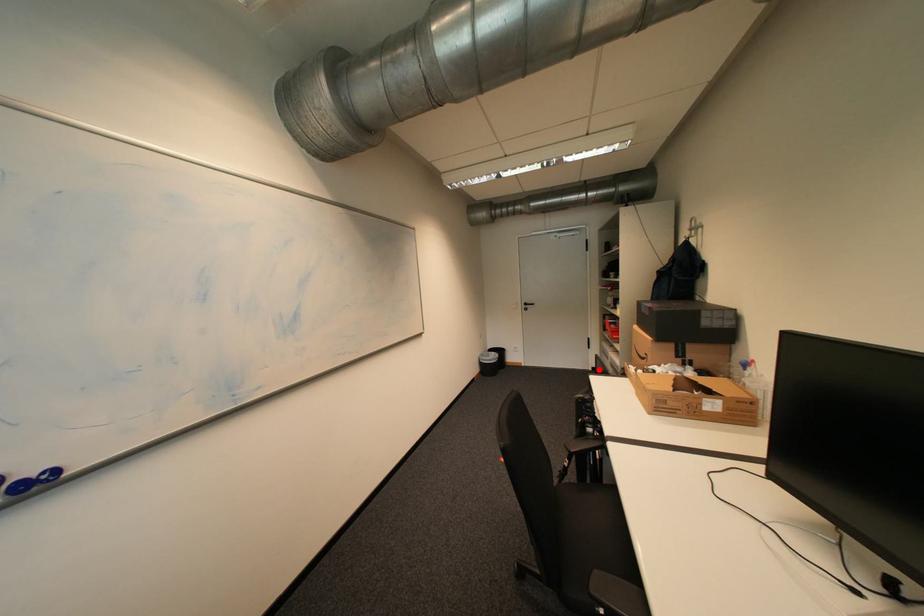
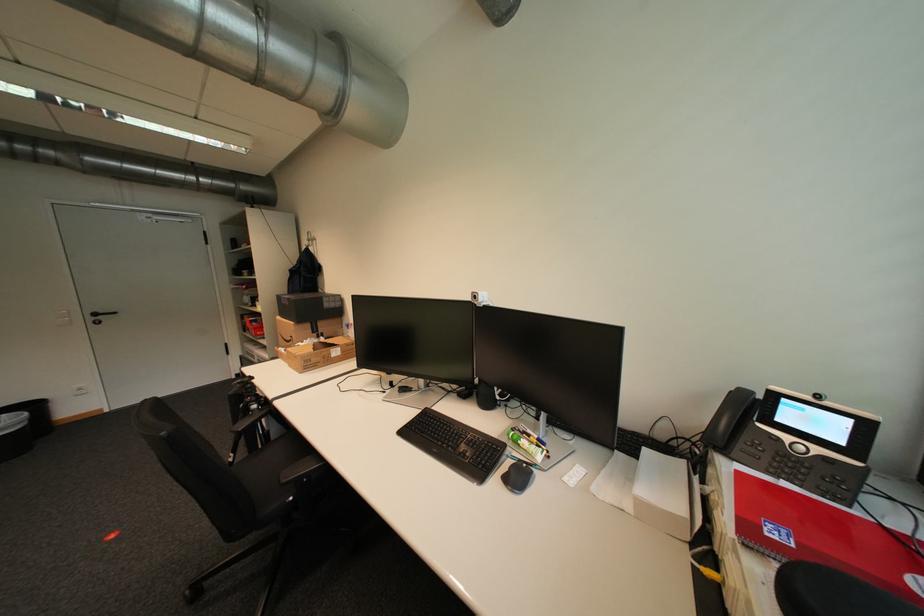
The point at the highlighted location is marked in the first image. Where is the corresponding point in the second image?

(242, 378)